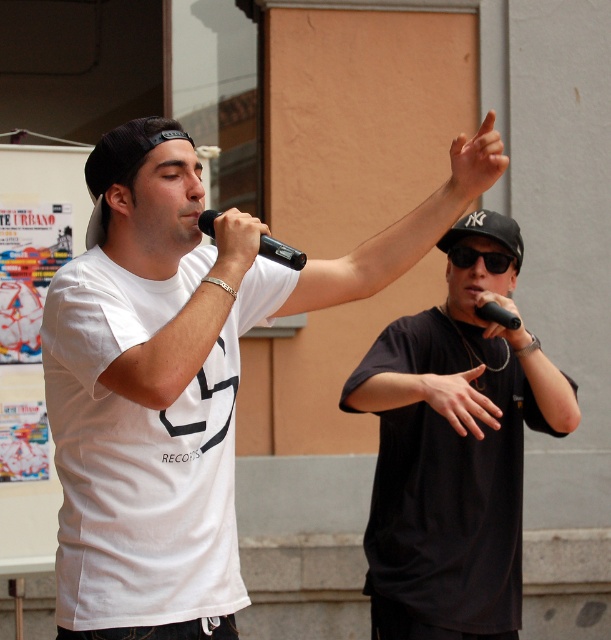
Who is shorter, smooth skin hand at center or black matte microphone at center?

black matte microphone at center

Who is lower down, smooth skin hand at center or black matte microphone at center?

smooth skin hand at center is lower down.

The width and height of the screenshot is (611, 640). Describe the element at coordinates (455, 400) in the screenshot. I see `smooth skin hand at center` at that location.

Identify the location of smooth skin hand at center. The height and width of the screenshot is (640, 611). (455, 400).

Measure the distance from black fabric baseball cap at upper right to black matte microphone at center.

They are 4.14 feet apart.

Can you confirm if black fabric baseball cap at upper right is taller than black matte microphone at center?

Correct, black fabric baseball cap at upper right is much taller as black matte microphone at center.

I want to click on black fabric baseball cap at upper right, so click(486, 230).

This screenshot has width=611, height=640. Find the location of `black fabric baseball cap at upper right`. black fabric baseball cap at upper right is located at coordinates (486, 230).

Who is positioned more to the left, black matte t-shirt at center or black fabric baseball cap at upper right?

From the viewer's perspective, black fabric baseball cap at upper right appears more on the left side.

Is point (456, 636) in front of point (505, 228)?

Yes, it is in front of point (505, 228).

The height and width of the screenshot is (640, 611). I want to click on black matte t-shirt at center, so click(x=455, y=445).